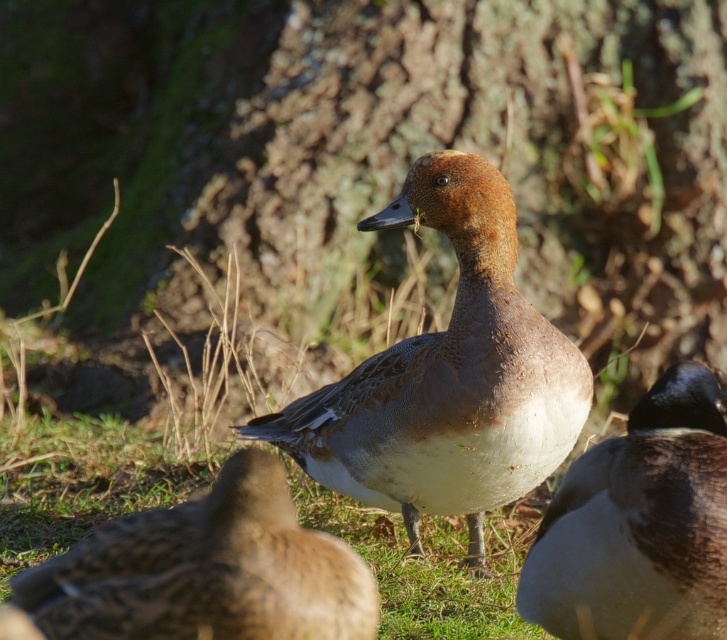
Based on the photo, can you confirm if brown feathered duck at center is positioned to the left of brown matte duck at center?

Indeed, brown feathered duck at center is positioned on the left side of brown matte duck at center.

Who is more forward, (462,378) or (718,624)?

Point (718,624) is in front.

Is point (353, 368) positioned after point (648, 451)?

Yes, point (353, 368) is behind point (648, 451).

The image size is (727, 640). I want to click on brown feathered duck at center, so click(x=446, y=378).

Is brown feathered duck at center thinner than brown speckled duck at center?

Incorrect, brown feathered duck at center's width is not less than brown speckled duck at center's.

Is brown feathered duck at center taller than brown speckled duck at center?

Yes, brown feathered duck at center is taller than brown speckled duck at center.

This screenshot has width=727, height=640. Identify the location of brown feathered duck at center. (446, 378).

Who is lower down, brown speckled duck at center or brown matte duck at center?

brown matte duck at center

Is brown speckled duck at center thinner than brown matte duck at center?

Incorrect, brown speckled duck at center's width is not less than brown matte duck at center's.

Find the location of a particular element. The image size is (727, 640). brown speckled duck at center is located at coordinates (204, 572).

Find the location of `brown speckled duck at center`. brown speckled duck at center is located at coordinates (204, 572).